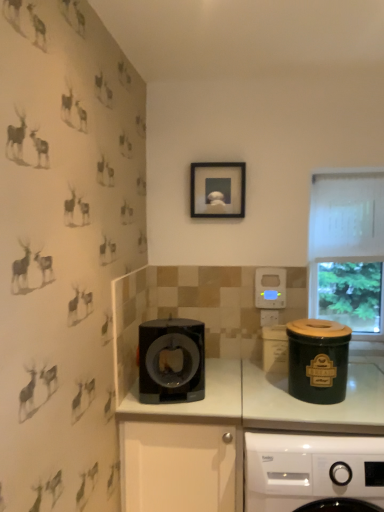
Where is `vacant space in black glossy coffee maker at center (from a real-world perspective)`? Image resolution: width=384 pixels, height=512 pixels. vacant space in black glossy coffee maker at center (from a real-world perspective) is located at coordinates (166, 401).